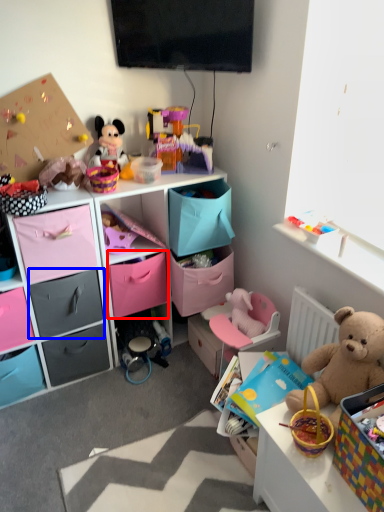
Question: Which point is further to the camera, drawer (highlighted by a red box) or drawer (highlighted by a blue box)?

Choices:
 (A) drawer
 (B) drawer

Answer: (A)